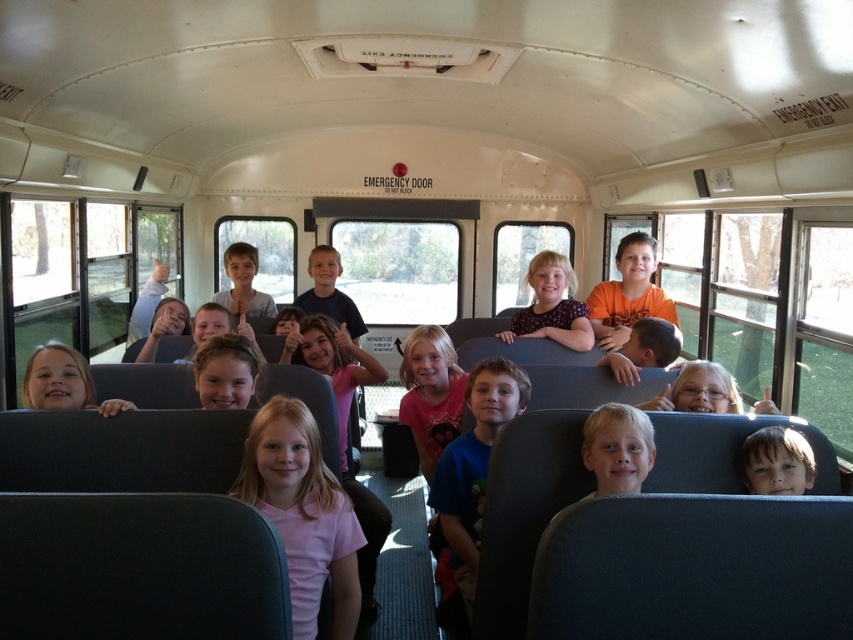
You are standing at the front of the school bus and want to locate the child with the light blonde hair at center. According to the coordinates provided, where should you look relative to your position?

The light blonde hair at center is located at point 0.702 on the x axis and 0.725 on the y axis. Since you are at the front of the bus, you should look towards the middle right and slightly forward to find the child with the light blonde hair at center.

You are a student sitting at point (598, 417) and want to move to the back of the bus. Is the point (641, 296) located behind you?

Yes, the point (641, 296) is behind the point (598, 417), so it is located behind you.

You are a photographer taking a group photo of the children on the school bus. You need to ensure that both the light blonde hair at center and the smooth blonde hair at lower right are visible in the photo. Based on their positions, which child should you focus on first to capture both in the frame?

You should focus on the light blonde hair at center first because it is above the smooth blonde hair at lower right, so capturing it first ensures both are in the frame.